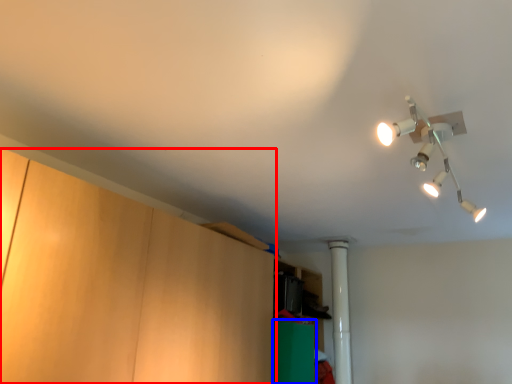
Question: Among these objects, which one is nearest to the camera, cabinetry (highlighted by a red box) or cabinetry (highlighted by a blue box)?

Choices:
 (A) cabinetry
 (B) cabinetry

Answer: (A)